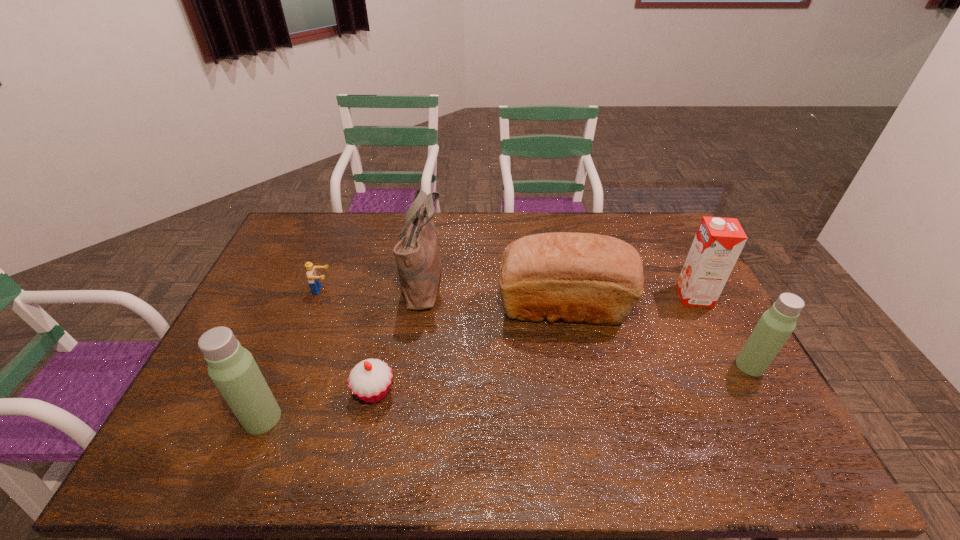
You are a GUI agent. You are given a task and a screenshot of the screen. Output one action in this format:
    pyautogui.click(x=<x>, y=<y>)
    Task: Click on the thermos bottle at the right edge
    
    Given the screenshot: What is the action you would take?
    pyautogui.click(x=775, y=326)

Where is `carton that is positioned at the right edge`? The height and width of the screenshot is (540, 960). carton that is positioned at the right edge is located at coordinates (719, 241).

Image resolution: width=960 pixels, height=540 pixels. Identify the location of object at the near left corner. (232, 368).

At what (x,y) coordinates should I click in order to perform the action: click on vacant space at the far edge of the desktop. Please return your answer as a coordinate pair (x, y). The width and height of the screenshot is (960, 540). Looking at the image, I should click on (370, 242).

Locate an element on the screen. The image size is (960, 540). vacant space at the near edge of the desktop is located at coordinates (668, 419).

Where is `vacant space at the left edge of the desktop`? The width and height of the screenshot is (960, 540). vacant space at the left edge of the desktop is located at coordinates (280, 338).

Locate an element on the screen. free region at the right edge is located at coordinates (688, 308).

Identify the location of vacant space at the near right corner. This screenshot has width=960, height=540. (780, 425).

Locate an element on the screen. free space between the shoulder bag and the left thermos bottle is located at coordinates (344, 349).

Image resolution: width=960 pixels, height=540 pixels. Find the location of `vacant area between the shoulder bag and the left thermos bottle`. vacant area between the shoulder bag and the left thermos bottle is located at coordinates (344, 349).